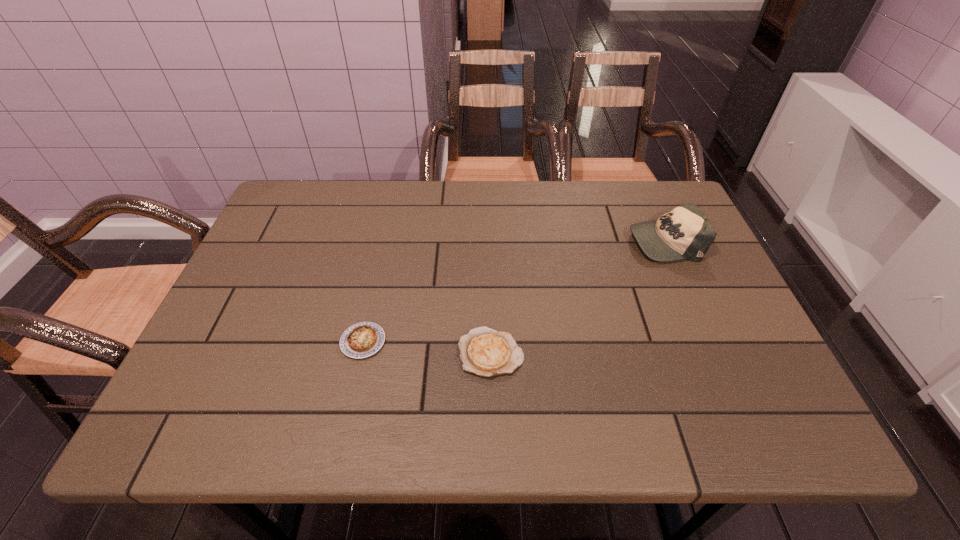
Identify the location of empty space that is in between the right quiche and the tallest object. This screenshot has height=540, width=960. (578, 297).

You are a GUI agent. You are given a task and a screenshot of the screen. Output one action in this format:
    pyautogui.click(x=<x>, y=<y>)
    Task: Click on the free space that is in between the left quiche and the second object from right to left
    
    Given the screenshot: What is the action you would take?
    pyautogui.click(x=427, y=347)

Where is `vacant area that lies between the leftmost object and the right quiche`? The width and height of the screenshot is (960, 540). vacant area that lies between the leftmost object and the right quiche is located at coordinates (427, 347).

At what (x,y) coordinates should I click in order to perform the action: click on free point between the second object from left to right and the left quiche. Please return your answer as a coordinate pair (x, y). The height and width of the screenshot is (540, 960). Looking at the image, I should click on (427, 347).

Find the location of a particular element. This screenshot has height=540, width=960. vacant space that is in between the second object from left to right and the baseball cap is located at coordinates (578, 297).

Locate an element on the screen. free area in between the leftmost object and the baseball cap is located at coordinates click(x=514, y=291).

The height and width of the screenshot is (540, 960). I want to click on empty space that is in between the left quiche and the farthest object, so click(514, 291).

I want to click on empty location between the leftmost object and the second object from left to right, so click(x=427, y=347).

You are a GUI agent. You are given a task and a screenshot of the screen. Output one action in this format:
    pyautogui.click(x=<x>, y=<y>)
    Task: Click on the vacant area between the right quiche and the rightmost object
    
    Given the screenshot: What is the action you would take?
    pyautogui.click(x=578, y=297)

Select which object is the closest to the left quiche. Please provide its 2D coordinates. Your answer should be formatted as a tuple, i.e. [(x, y)], where the tuple contains the x and y coordinates of a point satisfying the conditions above.

[(486, 352)]